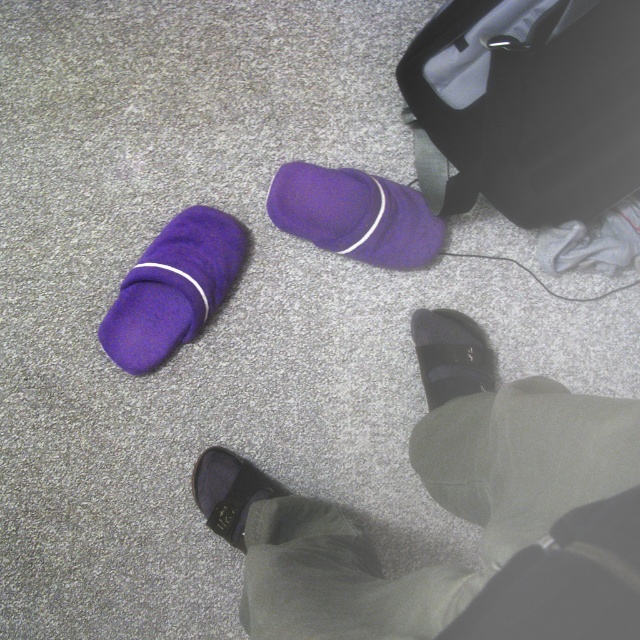
How distant is black leather sandals at lower center from purple fleece sock at center?

The distance of black leather sandals at lower center from purple fleece sock at center is 12.99 inches.

Measure the distance between black leather sandals at lower center and purple fleece sock at center.

black leather sandals at lower center and purple fleece sock at center are 12.99 inches apart.

You are a GUI agent. You are given a task and a screenshot of the screen. Output one action in this format:
    pyautogui.click(x=<x>, y=<y>)
    Task: Click on the black leather sandals at lower center
    Image resolution: width=640 pixels, height=640 pixels.
    Given the screenshot: What is the action you would take?
    pyautogui.click(x=456, y=515)

Between purple fleece slipper at upper left and black matte shoe at lower center, which one is positioned lower?

black matte shoe at lower center is below.

Identify the location of purple fleece slipper at upper left. (173, 288).

Between black leather sandals at lower center and velvet black slipper at lower center, which one is positioned higher?

Positioned higher is black leather sandals at lower center.

Which is behind, point (541, 397) or point (244, 520)?

The point (244, 520) is more distant.

Does point (589, 410) come closer to viewer compared to point (209, 516)?

Yes, point (589, 410) is in front of point (209, 516).

The image size is (640, 640). Identify the location of black leather sandals at lower center. (456, 515).